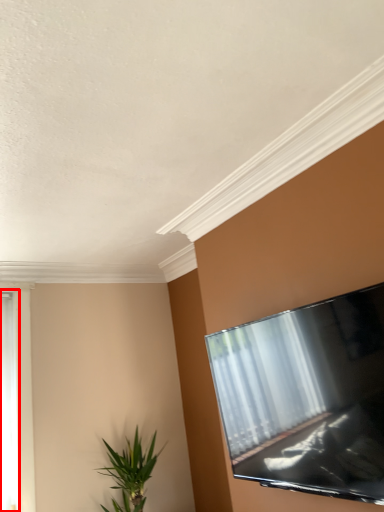
Question: From the image's perspective, where is window (annotated by the red box) located relative to houseplant?

Choices:
 (A) above
 (B) below

Answer: (A)